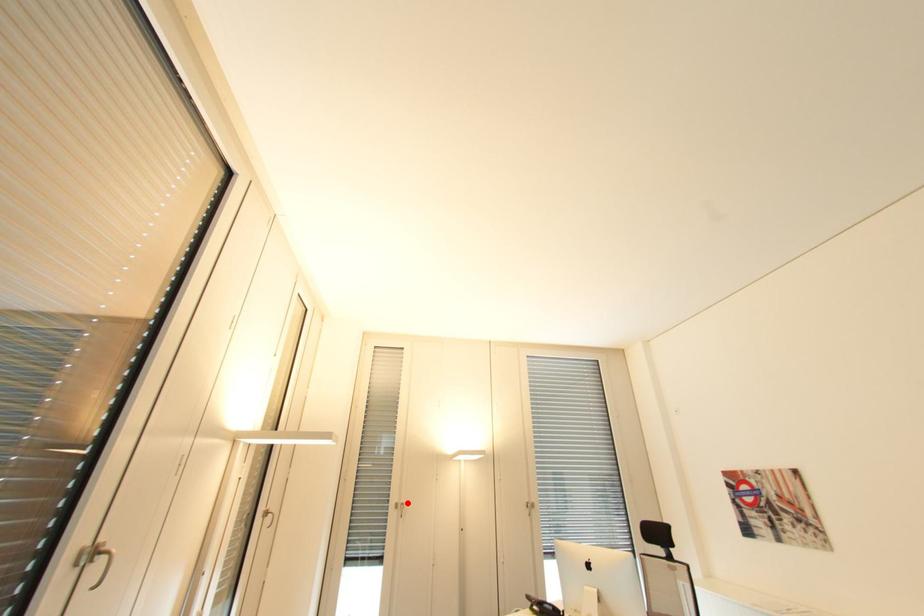
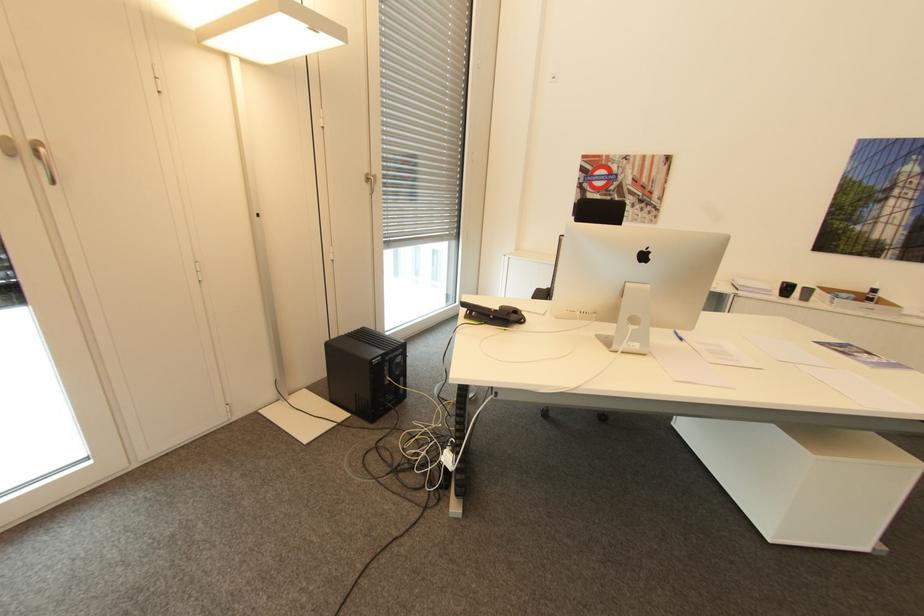
Question: I am providing you with two images of the same scene from different viewpoints. In image1, a red point is highlighted. Considering the same 3D point in image2, which of the following is correct?

Choices:
 (A) It is closer
 (B) It is farther

Answer: (B)